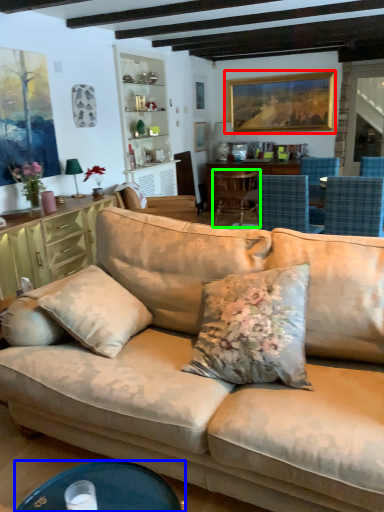
Question: Estimate the real-world distances between objects in this image. Which object is farther from picture frame (highlighted by a red box), desk (highlighted by a blue box) or chair (highlighted by a green box)?

Choices:
 (A) desk
 (B) chair

Answer: (A)